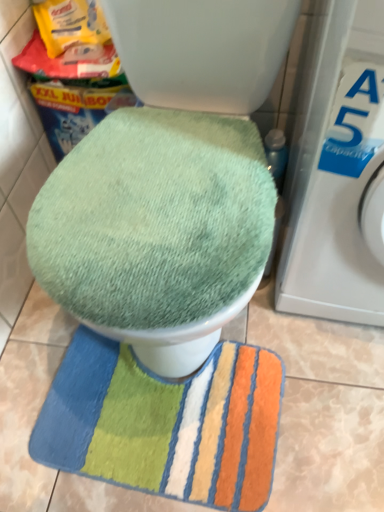
Question: Is green plush rug at lower center spatially inside white plastic washing machine at right, or outside of it?

Choices:
 (A) outside
 (B) inside

Answer: (A)

Question: Is green plush rug at lower center in front of or behind white plastic washing machine at right in the image?

Choices:
 (A) front
 (B) behind

Answer: (B)

Question: Which object is the closest to the white plastic washing machine at right?

Choices:
 (A) green fabric toilet seat at center
 (B) green plush rug at lower center

Answer: (A)

Question: Estimate the real-world distances between objects in this image. Which object is closer to the green fabric toilet seat at center?

Choices:
 (A) green plush rug at lower center
 (B) white plastic washing machine at right

Answer: (B)